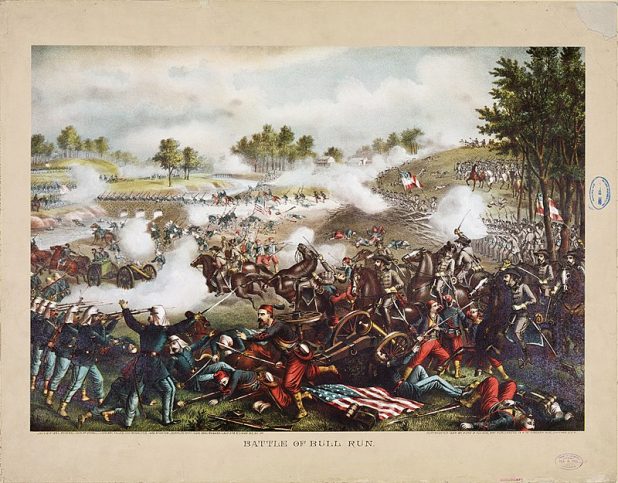
Image resolution: width=618 pixels, height=483 pixels. Identify the location of paitning. (369, 275).